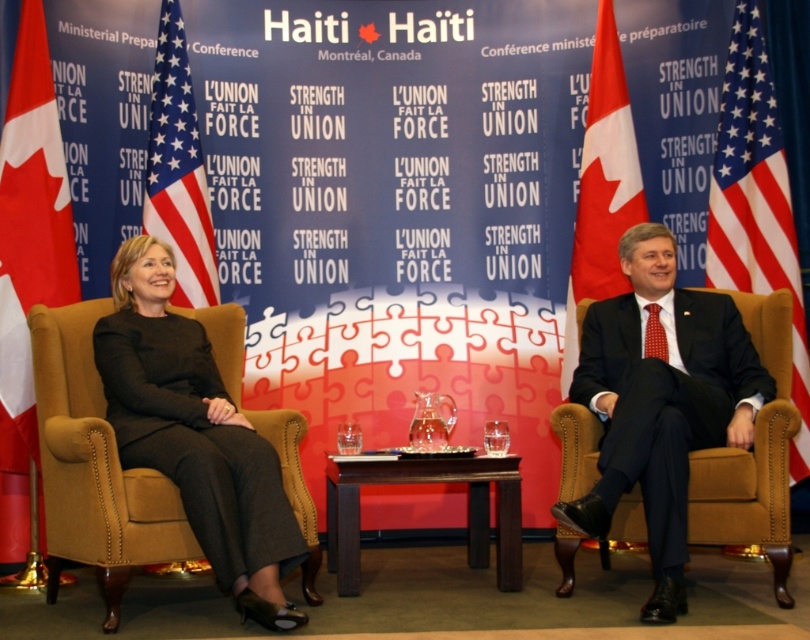
Does black fabric suit at left appear on the right side of american flag at left?

Indeed, black fabric suit at left is positioned on the right side of american flag at left.

The width and height of the screenshot is (810, 640). What are the coordinates of `black fabric suit at left` in the screenshot? It's located at (195, 435).

Where is `black fabric suit at left`? This screenshot has width=810, height=640. black fabric suit at left is located at coordinates (195, 435).

Can you confirm if american flag at right is taller than red fabric flag at right?

Indeed, american flag at right has a greater height compared to red fabric flag at right.

Is point (757, 120) farther from viewer compared to point (621, 97)?

No, (757, 120) is in front of (621, 97).

This screenshot has width=810, height=640. Identify the location of american flag at right. (757, 202).

Can you confirm if black fabric suit at left is wider than red fabric flag at right?

Yes, black fabric suit at left is wider than red fabric flag at right.

Is point (258, 579) less distant than point (595, 275)?

That is True.

Locate an element on the screen. black fabric suit at left is located at coordinates (195, 435).